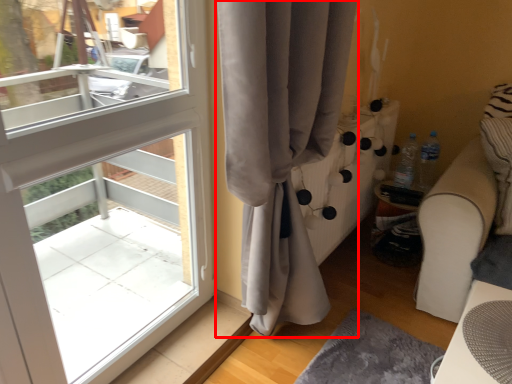
Question: From the image's perspective, where is curtain (annotated by the red box) located in relation to table in the image?

Choices:
 (A) below
 (B) above

Answer: (B)